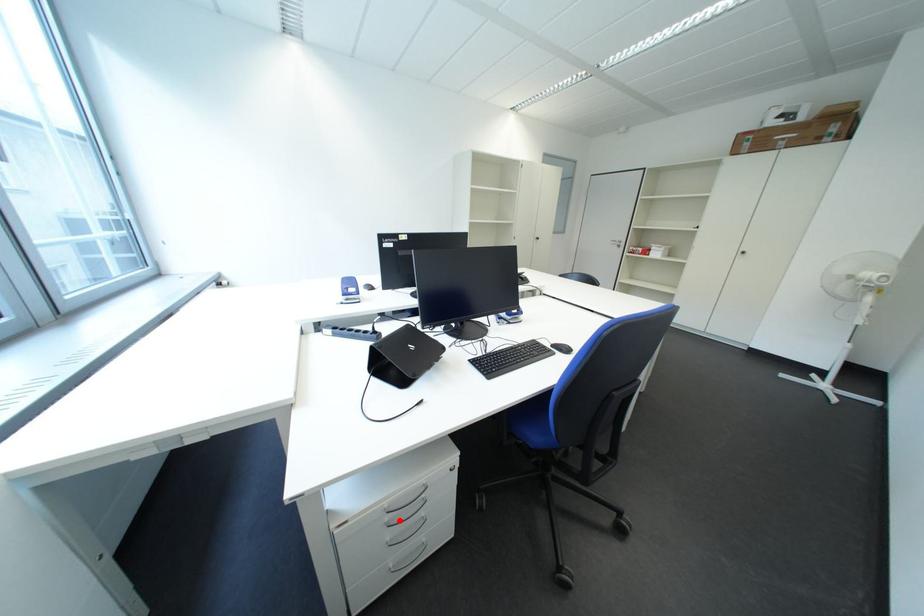
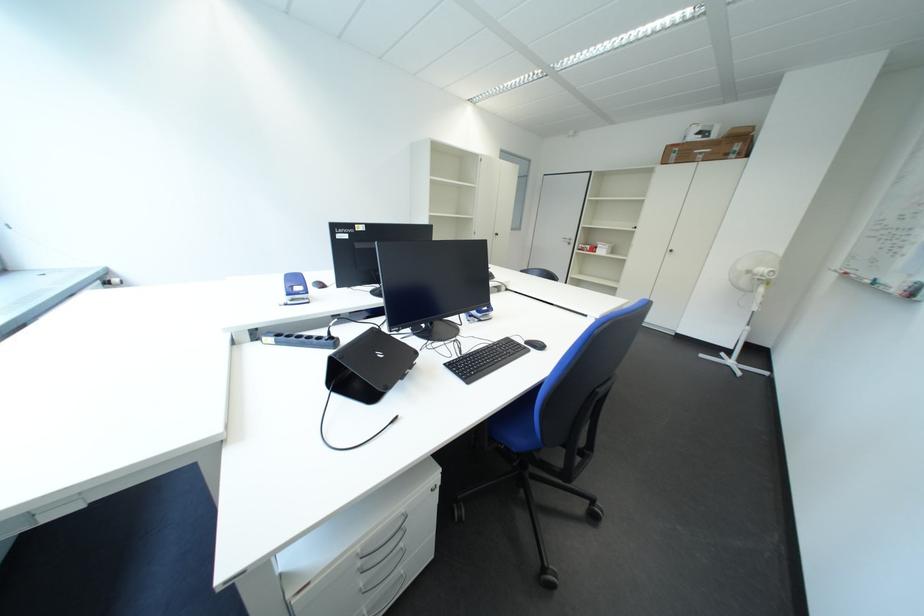
Where in the second image is the point corresponding to the highlighted location from the first image?

(371, 565)